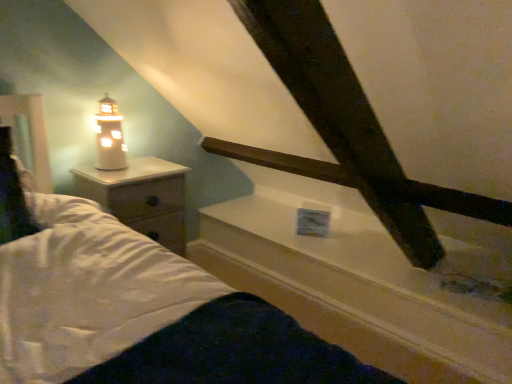
The height and width of the screenshot is (384, 512). Identify the location of vacant space in front of white ceramic lighthouse at left. (108, 178).